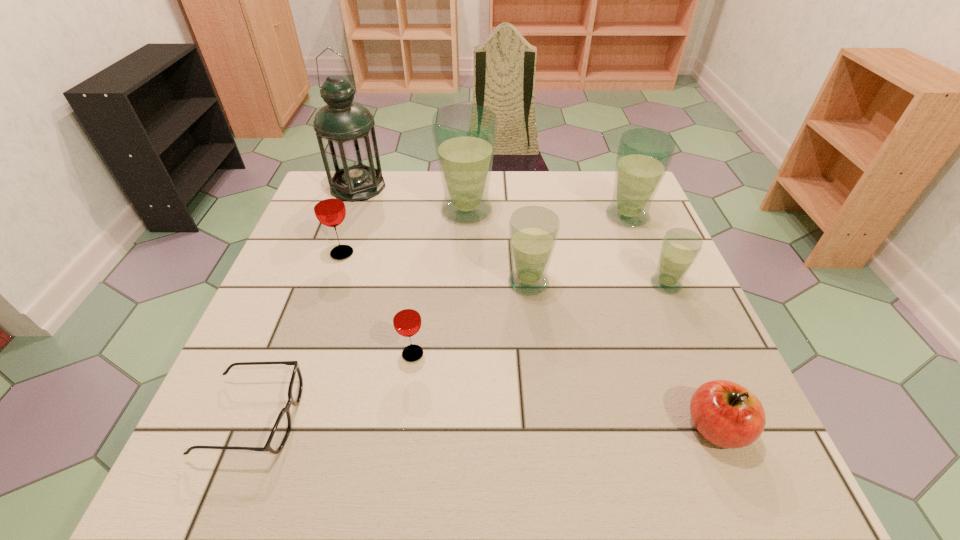
This screenshot has height=540, width=960. What are the coordinates of `the smallest blue glass` in the screenshot? It's located at (680, 247).

Identify the location of the smaller red glass. (406, 317).

Identify the location of the third nearest object. point(406,317).

Identify the location of the second shortest object. This screenshot has height=540, width=960. (726, 414).

Where is `apple`? The height and width of the screenshot is (540, 960). apple is located at coordinates (726, 414).

This screenshot has width=960, height=540. In order to click on spectacles in this screenshot , I will do `click(280, 432)`.

The height and width of the screenshot is (540, 960). In order to click on free space located on the right of the green oil lamp in this screenshot , I will do `click(469, 187)`.

Where is `free region located 0.350m on the right of the eighth shortest object`? This screenshot has width=960, height=540. free region located 0.350m on the right of the eighth shortest object is located at coordinates (x=621, y=211).

Where is `vacant space located on the front of the second biggest blue glass`? Image resolution: width=960 pixels, height=540 pixels. vacant space located on the front of the second biggest blue glass is located at coordinates (640, 248).

The width and height of the screenshot is (960, 540). What are the coordinates of `blank area located 0.150m on the right of the left red glass` in the screenshot? It's located at (417, 253).